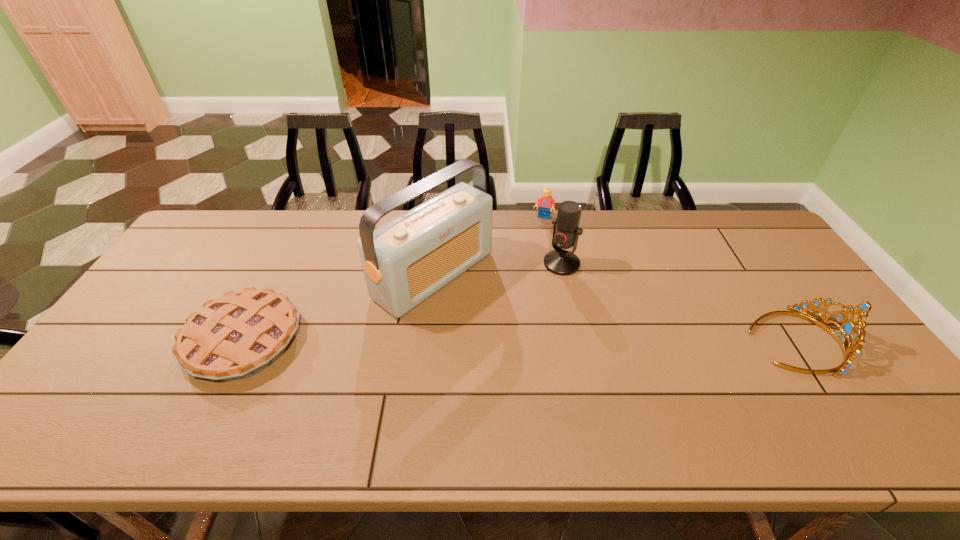
Locate an element on the screen. free space on the desktop that is between the shortest object and the rightmost object and is positioned on the side of the microphone with the red ring is located at coordinates pyautogui.click(x=484, y=340).

Identify the location of free space on the desktop that is between the pie and the tiara and is positioned on the face of the farthest object. (501, 340).

Locate an element on the screen. The image size is (960, 540). free space on the desktop that is between the pie and the rightmost object and is positioned on the front-facing side of the fourth object from right to left is located at coordinates tap(532, 340).